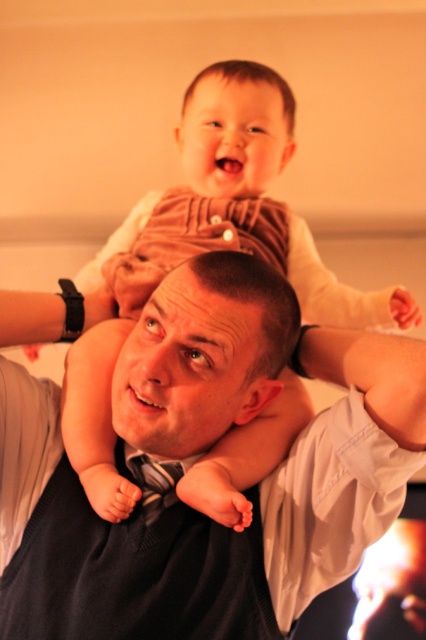
Question: Among these objects, which one is farthest from the camera?

Choices:
 (A) silky black tie at center
 (B) brown corduroy pants at upper center

Answer: (A)

Question: In this image, where is matte black shirt at center located relative to brown corduroy pants at upper center?

Choices:
 (A) right
 (B) left

Answer: (B)

Question: Can you confirm if matte black shirt at center is bigger than silky black tie at center?

Choices:
 (A) yes
 (B) no

Answer: (A)

Question: Which point is closer to the camera?

Choices:
 (A) matte black shirt at center
 (B) silky black tie at center
 (C) brown corduroy pants at upper center

Answer: (C)

Question: Can you confirm if brown corduroy pants at upper center is smaller than silky black tie at center?

Choices:
 (A) yes
 (B) no

Answer: (B)

Question: Which is nearer to the silky black tie at center?

Choices:
 (A) matte black shirt at center
 (B) brown corduroy pants at upper center

Answer: (A)